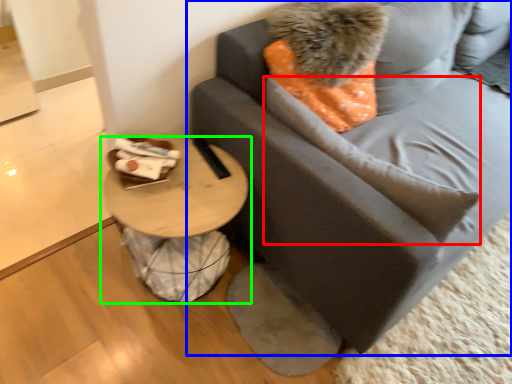
Question: Considering the real-world distances, which object is farthest from pillow (highlighted by a red box)? studio couch (highlighted by a blue box) or table (highlighted by a green box)?

Choices:
 (A) studio couch
 (B) table

Answer: (B)